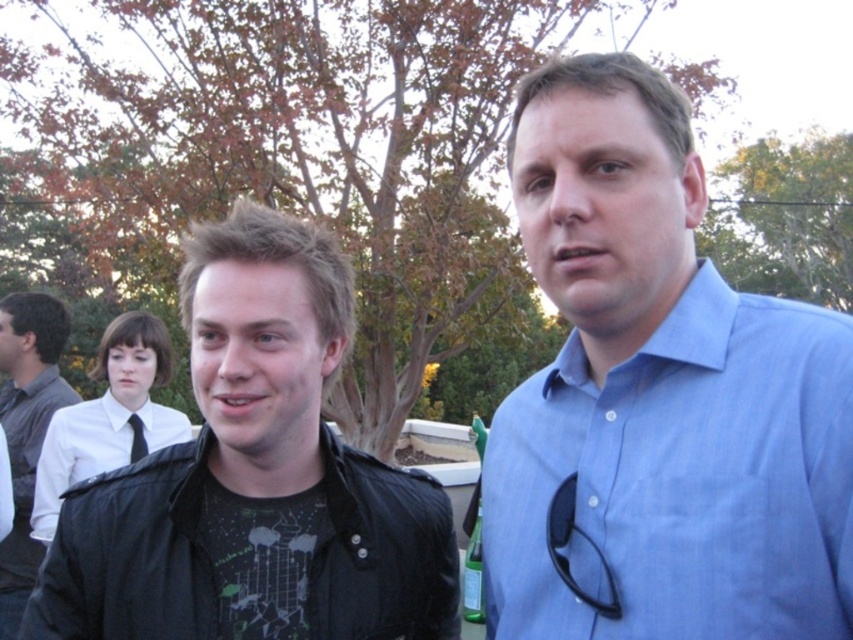
Does blue cotton shirt at upper right have a lesser width compared to white smooth shirt at upper left?

Yes.

Is point (703, 436) in front of point (173, 442)?

Yes, it is.

Identify the location of blue cotton shirt at upper right. The width and height of the screenshot is (853, 640). (659, 396).

Locate an element on the screen. blue cotton shirt at upper right is located at coordinates tap(659, 396).

Which is in front, point (44, 296) or point (134, 438)?

Point (134, 438)

From the picture: Can you confirm if dark gray shirt at left is positioned below black silk tie at center?

Yes.

Who is more forward, (22,364) or (135,442)?

Point (135,442)

Where is `dark gray shirt at left`? The height and width of the screenshot is (640, 853). dark gray shirt at left is located at coordinates (26, 429).

Is the position of blue cotton shirt at upper right more distant than that of dark gray shirt at left?

That is False.

You are a GUI agent. You are given a task and a screenshot of the screen. Output one action in this format:
    pyautogui.click(x=<x>, y=<y>)
    Task: Click on the blue cotton shirt at upper right
    Image resolution: width=853 pixels, height=640 pixels.
    Given the screenshot: What is the action you would take?
    pyautogui.click(x=659, y=396)